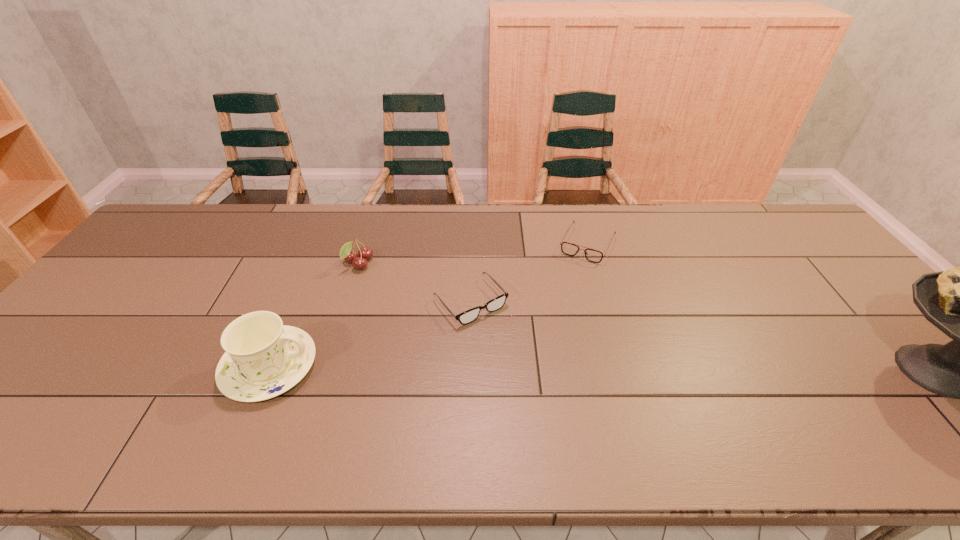
Find the location of a particular element. vacant space on the desktop that is between the fourth shortest object and the tallest object and is positioned on the leaves of the third tallest object is located at coordinates (529, 368).

What are the coordinates of `free space on the desktop that is between the chinaware and the tallest object and is positioned on the front-facing side of the spectacles` in the screenshot? It's located at (529, 368).

This screenshot has width=960, height=540. Find the location of `vacant spot on the desktop that is between the chinaware and the rightmost object and is positioned on the front-facing side of the fourth object from left to right`. vacant spot on the desktop that is between the chinaware and the rightmost object and is positioned on the front-facing side of the fourth object from left to right is located at coordinates (526, 368).